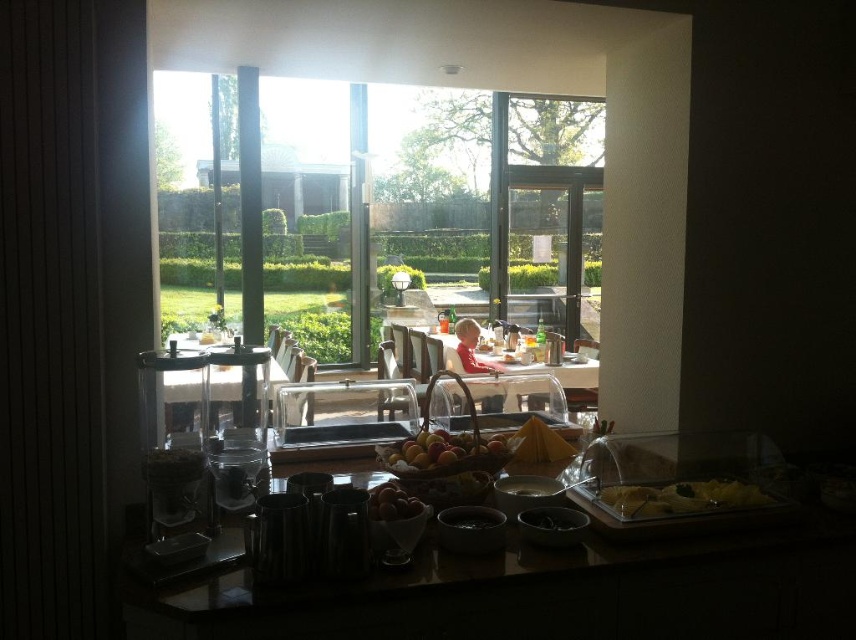
Question: Considering the relative positions of transparent glass door at center and smooth brown eggs at center in the image provided, where is transparent glass door at center located with respect to smooth brown eggs at center?

Choices:
 (A) above
 (B) below

Answer: (A)

Question: Does transparent glass window at center come behind transparent glass door at center?

Choices:
 (A) yes
 (B) no

Answer: (B)

Question: Which of these objects is positioned farthest from the white glossy table at center?

Choices:
 (A) glossy wooden fruit basket at center
 (B) transparent glass window at center
 (C) yellow matte pasta at lower right
 (D) smooth brown eggs at center

Answer: (D)

Question: Observing the image, what is the correct spatial positioning of white glossy table at center in reference to smooth brown eggs at center?

Choices:
 (A) left
 (B) right

Answer: (B)

Question: Which object appears farthest from the camera in this image?

Choices:
 (A) smooth brown eggs at center
 (B) transparent glass door at center
 (C) yellow matte pasta at lower right

Answer: (B)

Question: Which point is closer to the camera taking this photo?

Choices:
 (A) (393, 493)
 (B) (488, 440)
 (C) (357, 323)
 (D) (734, 483)

Answer: (A)